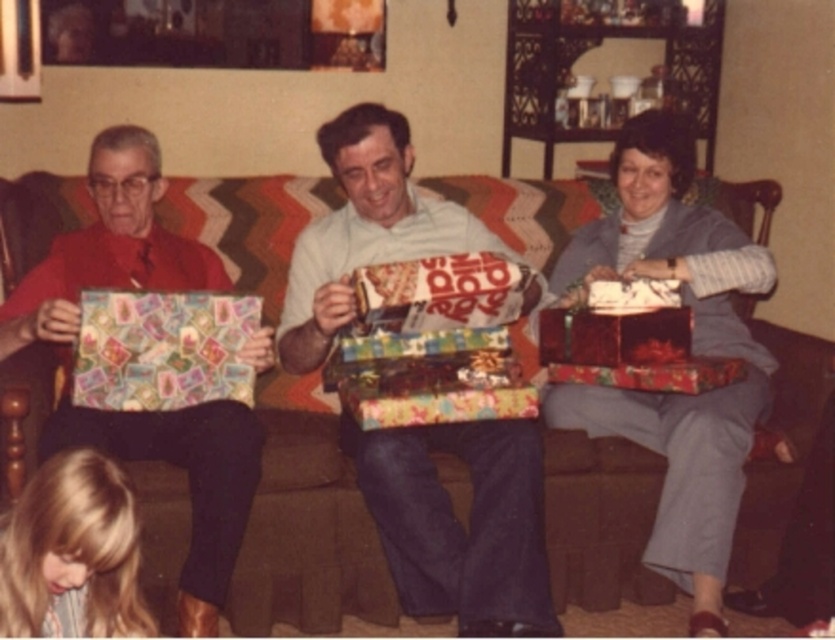
Which is more to the left, brown fabric couch at center or matte red card at left?

matte red card at left

Who is higher up, brown fabric couch at center or matte red card at left?

brown fabric couch at center is higher up.

Between point (626, 557) and point (97, 147), which one is positioned in front?

Point (97, 147) is in front.

This screenshot has height=640, width=835. What are the coordinates of `brown fabric couch at center` in the screenshot? It's located at (306, 524).

Can you confirm if shiny metallic gift at center is bigger than blonde hair at lower left?

A: Correct, shiny metallic gift at center is larger in size than blonde hair at lower left.

Can you confirm if shiny metallic gift at center is wider than blonde hair at lower left?

Correct, the width of shiny metallic gift at center exceeds that of blonde hair at lower left.

Is point (416, 211) in front of point (58, 483)?

No, it is not.

Locate an element on the screen. The width and height of the screenshot is (835, 640). shiny metallic gift at center is located at coordinates (459, 524).

Which is more to the left, brown fabric couch at center or matte gray sweater at center?

From the viewer's perspective, brown fabric couch at center appears more on the left side.

This screenshot has width=835, height=640. What are the coordinates of `brown fabric couch at center` in the screenshot? It's located at (306, 524).